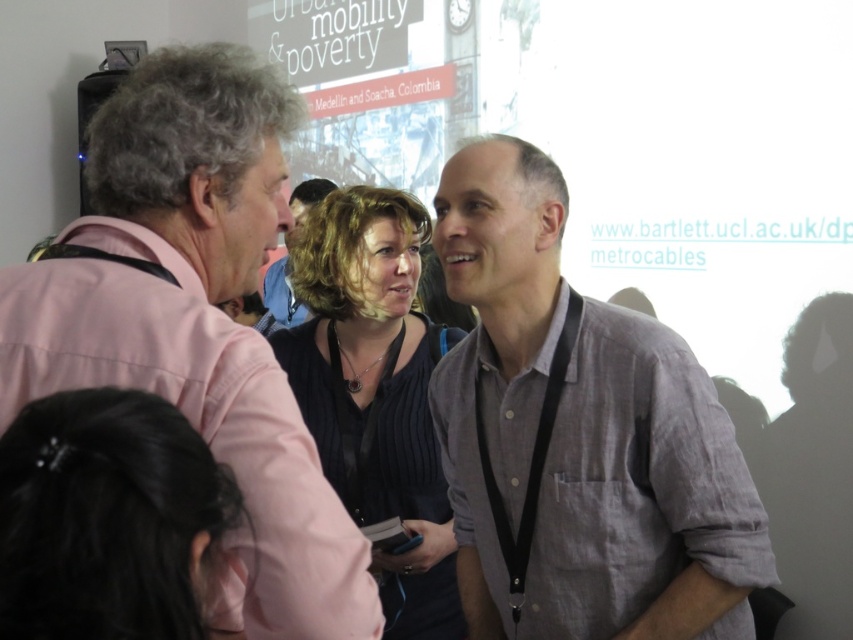
Question: Does gray linen shirt at center appear on the right side of black hair at lower left?

Choices:
 (A) no
 (B) yes

Answer: (B)

Question: Among these points, which one is farthest from the camera?

Choices:
 (A) (160, 420)
 (B) (178, 285)
 (C) (473, 508)

Answer: (C)

Question: Among these points, which one is farthest from the camera?

Choices:
 (A) (360, 403)
 (B) (280, 173)
 (C) (300, 195)

Answer: (C)

Question: Which of the following is the closest to the observer?

Choices:
 (A) (160, 481)
 (B) (302, 310)
 (C) (152, 372)

Answer: (A)

Question: In this image, where is gray linen shirt at center located relative to black hair at lower left?

Choices:
 (A) above
 (B) below

Answer: (A)

Question: Considering the relative positions of dark gray ribbed sweater at center and dark brown hair at center in the image provided, where is dark gray ribbed sweater at center located with respect to dark brown hair at center?

Choices:
 (A) above
 (B) below

Answer: (B)